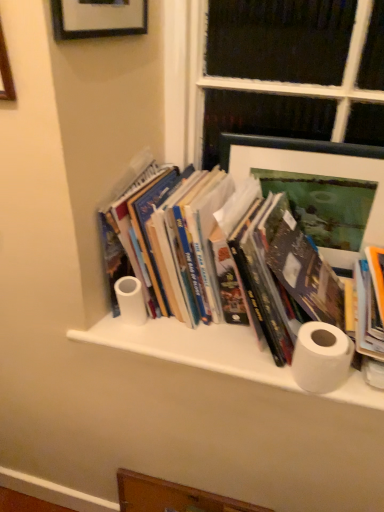
Question: Is hardcover books at center directly adjacent to matte green picture frame at upper right, the 2th picture frame positioned from the front?

Choices:
 (A) no
 (B) yes

Answer: (B)

Question: Is hardcover books at center to the left of matte green picture frame at upper right, which is counted as the 1th picture frame, starting from the bottom, from the viewer's perspective?

Choices:
 (A) no
 (B) yes

Answer: (B)

Question: Is matte green picture frame at upper right, which is counted as the first picture frame, starting from the right, located within hardcover books at center?

Choices:
 (A) yes
 (B) no

Answer: (B)

Question: Considering the relative sizes of hardcover books at center and matte green picture frame at upper right, which ranks as the 2th picture frame in left-to-right order, in the image provided, is hardcover books at center shorter than matte green picture frame at upper right, which ranks as the 2th picture frame in left-to-right order,?

Choices:
 (A) yes
 (B) no

Answer: (A)

Question: Does hardcover books at center turn towards matte green picture frame at upper right, the 2th picture frame positioned from the front?

Choices:
 (A) yes
 (B) no

Answer: (B)

Question: Considering the relative positions of white matte cabinet at center and white matte toilet paper at center, the first toilet paper viewed from the left, in the image provided, is white matte cabinet at center to the left or to the right of white matte toilet paper at center, the first toilet paper viewed from the left,?

Choices:
 (A) left
 (B) right

Answer: (B)

Question: Based on their sizes in the image, would you say white matte cabinet at center is bigger or smaller than white matte toilet paper at center, the 2th toilet paper viewed from the right?

Choices:
 (A) big
 (B) small

Answer: (A)

Question: From a real-world perspective, is white matte cabinet at center positioned above or below white matte toilet paper at center, the 2th toilet paper viewed from the front?

Choices:
 (A) below
 (B) above

Answer: (A)

Question: Is white matte cabinet at center inside the boundaries of white matte toilet paper at center, the first toilet paper viewed from the left, or outside?

Choices:
 (A) inside
 (B) outside

Answer: (B)

Question: Considering their positions, is wooden drawer at lower center located in front of or behind white matte toilet paper at right, the second toilet paper viewed from the left?

Choices:
 (A) behind
 (B) front

Answer: (A)

Question: Does point (231, 510) appear closer or farther from the camera than point (299, 339)?

Choices:
 (A) closer
 (B) farther

Answer: (B)

Question: From a real-world perspective, relative to white matte toilet paper at right, placed as the second toilet paper when sorted from back to front, is wooden drawer at lower center vertically above or below?

Choices:
 (A) below
 (B) above

Answer: (A)

Question: In the image, is wooden drawer at lower center on the left side or the right side of white matte toilet paper at right, the 1th toilet paper when ordered from right to left?

Choices:
 (A) right
 (B) left

Answer: (B)

Question: Does point (117, 280) appear closer or farther from the camera than point (266, 359)?

Choices:
 (A) farther
 (B) closer

Answer: (A)

Question: Is white matte toilet paper at center, placed as the first toilet paper when sorted from back to front, in front of or behind white matte cabinet at center in the image?

Choices:
 (A) behind
 (B) front

Answer: (A)